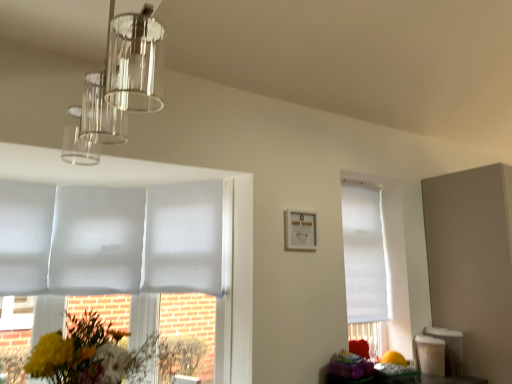
Question: Are white matte blind at right, which ranks as the first blind in right-to-left order, and clear glass pendant light at upper left making contact?

Choices:
 (A) yes
 (B) no

Answer: (B)

Question: Is white matte blind at right, placed as the fourth blind when sorted from left to right, outside of clear glass pendant light at upper left?

Choices:
 (A) yes
 (B) no

Answer: (A)

Question: Can you confirm if white matte blind at right, placed as the fourth blind when sorted from left to right, is positioned to the left of clear glass pendant light at upper left?

Choices:
 (A) no
 (B) yes

Answer: (A)

Question: Could you tell me if white matte blind at right, which ranks as the first blind in right-to-left order, is facing clear glass pendant light at upper left?

Choices:
 (A) yes
 (B) no

Answer: (B)

Question: Does white matte blind at right, placed as the fourth blind when sorted from left to right, have a smaller size compared to clear glass pendant light at upper left?

Choices:
 (A) no
 (B) yes

Answer: (B)

Question: Is clear glass pendant light at upper left inside or outside of fluffy bouquet at lower left?

Choices:
 (A) inside
 (B) outside

Answer: (B)

Question: Considering the positions of clear glass pendant light at upper left and fluffy bouquet at lower left in the image, is clear glass pendant light at upper left bigger or smaller than fluffy bouquet at lower left?

Choices:
 (A) small
 (B) big

Answer: (B)

Question: In terms of width, does clear glass pendant light at upper left look wider or thinner when compared to fluffy bouquet at lower left?

Choices:
 (A) wide
 (B) thin

Answer: (B)

Question: Is clear glass pendant light at upper left to the left or to the right of fluffy bouquet at lower left in the image?

Choices:
 (A) right
 (B) left

Answer: (A)

Question: Is white matte blind at left, positioned as the 4th blind in right-to-left order, wider or thinner than clear glass pendant light at upper left?

Choices:
 (A) thin
 (B) wide

Answer: (A)

Question: Considering the relative positions of white matte blind at left, positioned as the 4th blind in right-to-left order, and clear glass pendant light at upper left in the image provided, is white matte blind at left, positioned as the 4th blind in right-to-left order, to the left or to the right of clear glass pendant light at upper left?

Choices:
 (A) left
 (B) right

Answer: (A)

Question: Looking at the image, does white matte blind at left, which appears as the first blind when viewed from the left, seem bigger or smaller compared to clear glass pendant light at upper left?

Choices:
 (A) small
 (B) big

Answer: (A)

Question: Considering the positions of white matte blind at left, positioned as the 4th blind in right-to-left order, and clear glass pendant light at upper left in the image, is white matte blind at left, positioned as the 4th blind in right-to-left order, taller or shorter than clear glass pendant light at upper left?

Choices:
 (A) short
 (B) tall

Answer: (B)

Question: Does point (38, 231) appear closer or farther from the camera than point (49, 289)?

Choices:
 (A) farther
 (B) closer

Answer: (A)

Question: Would you say white matte blind at left, positioned as the 4th blind in right-to-left order, is inside or outside white matte blind at left, the third blind from the right?

Choices:
 (A) inside
 (B) outside

Answer: (B)